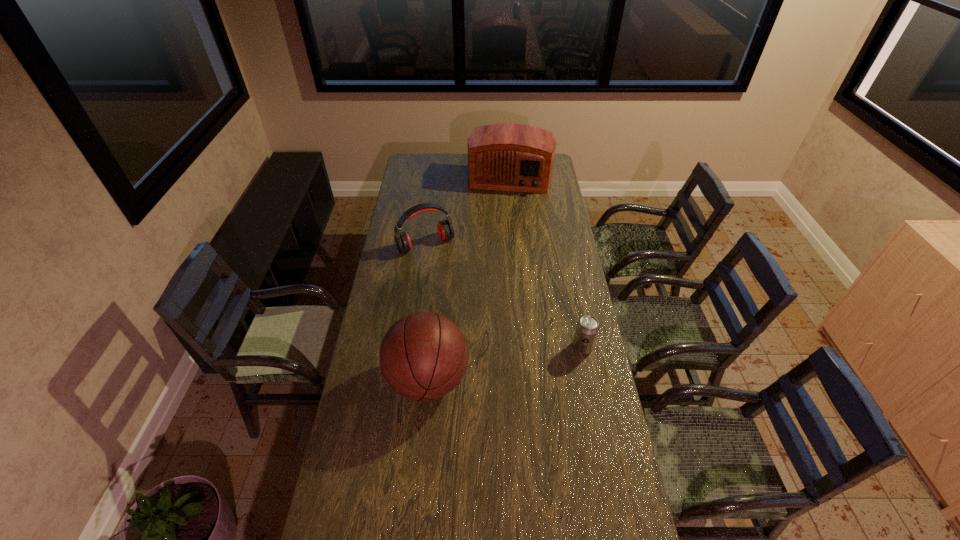
Where is `vacant spot on the desktop that is between the basketball and the shortest object and is positioned on the front-facing side of the farthest object`? Image resolution: width=960 pixels, height=540 pixels. vacant spot on the desktop that is between the basketball and the shortest object and is positioned on the front-facing side of the farthest object is located at coordinates (485, 368).

This screenshot has width=960, height=540. In order to click on vacant spot on the desktop that is between the basketball and the shortest object and is positioned on the ear cups of the earphone in this screenshot , I will do `click(497, 365)`.